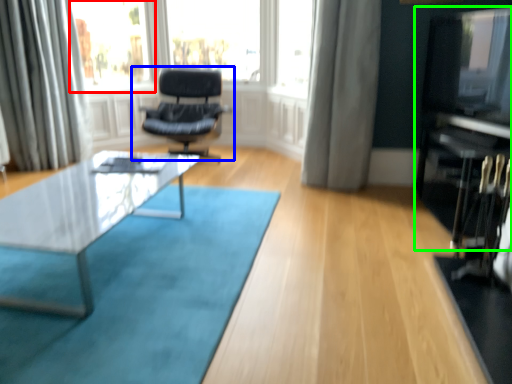
Question: Which object is positioned closest to bay window (highlighted by a red box)? Select from chair (highlighted by a blue box) and entertainment center (highlighted by a green box).

Choices:
 (A) chair
 (B) entertainment center

Answer: (A)